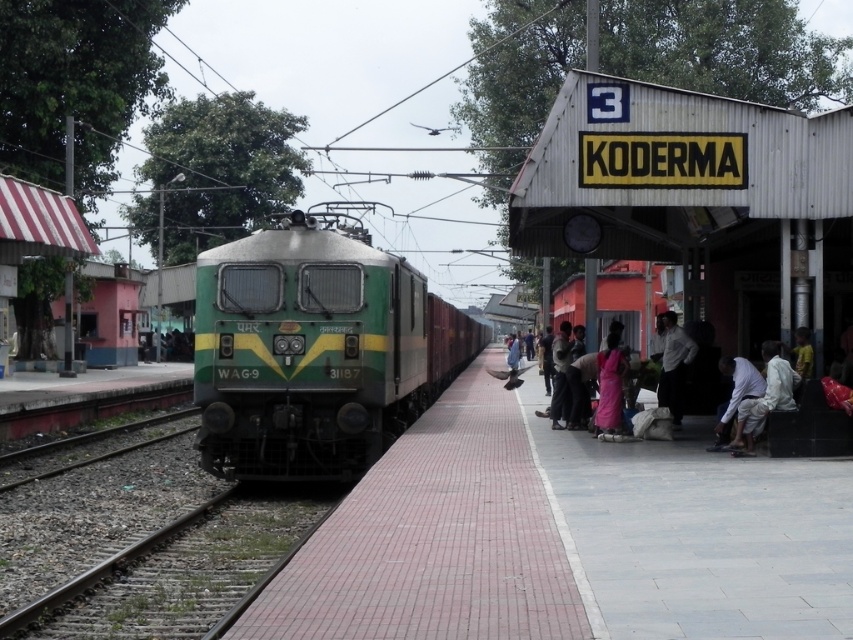
Which is behind, point (671, 342) or point (724, 362)?

Positioned behind is point (671, 342).

Who is positioned more to the left, white shirt at center or light brown fabric pants at lower right?

white shirt at center

I want to click on white shirt at center, so point(672,365).

Where is `white shirt at center`? white shirt at center is located at coordinates (672, 365).

Is point (254, 317) closer to camera compared to point (164, 628)?

No, it is not.

Does green matte train at center appear under gravelly brown train track at lower left?

No, green matte train at center is not below gravelly brown train track at lower left.

Which is behind, point (299, 371) or point (264, 486)?

Positioned behind is point (264, 486).

In order to click on green matte train at center in this screenshot , I will do pos(315,349).

Is pink fabric at center below light brown fabric pants at lower right?

Correct, pink fabric at center is located below light brown fabric pants at lower right.

Locate an element on the screen. pink fabric at center is located at coordinates (809, 426).